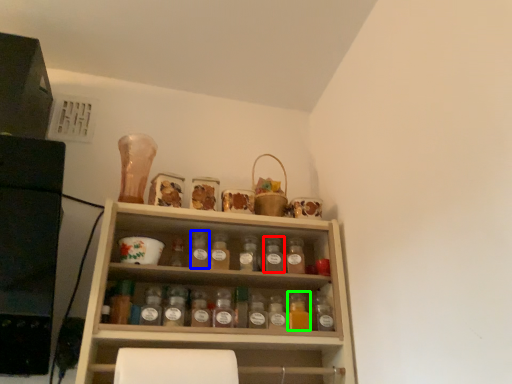
Question: Based on their relative distances, which object is nearer to bottle (highlighted by a red box)? Choose from bottle (highlighted by a blue box) and bottle (highlighted by a green box).

Choices:
 (A) bottle
 (B) bottle

Answer: (B)